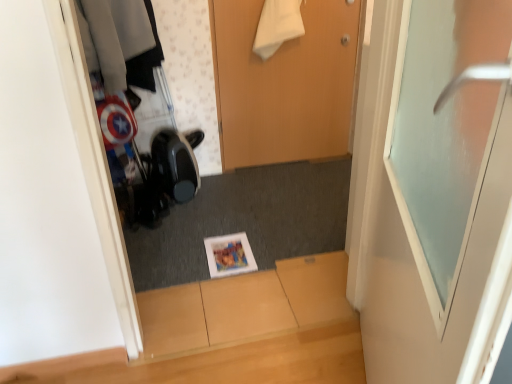
Question: Is frosted glass door at upper right, the first door when ordered from front to back, oriented away from wooden door at center, the second door when ordered from front to back?

Choices:
 (A) yes
 (B) no

Answer: (B)

Question: From the image's perspective, is frosted glass door at upper right, which appears as the 2th door when viewed from the back, below wooden door at center, which is the first door in back-to-front order?

Choices:
 (A) no
 (B) yes

Answer: (B)

Question: Can you confirm if frosted glass door at upper right, the first door when ordered from front to back, is wider than wooden door at center, the second door when ordered from front to back?

Choices:
 (A) yes
 (B) no

Answer: (A)

Question: Is the depth of frosted glass door at upper right, which appears as the 2th door when viewed from the back, less than that of wooden door at center, the second door when ordered from front to back?

Choices:
 (A) yes
 (B) no

Answer: (A)

Question: Considering the relative sizes of frosted glass door at upper right, which appears as the 2th door when viewed from the back, and wooden door at center, the second door when ordered from front to back, in the image provided, is frosted glass door at upper right, which appears as the 2th door when viewed from the back, thinner than wooden door at center, the second door when ordered from front to back,?

Choices:
 (A) yes
 (B) no

Answer: (B)

Question: Is frosted glass door at upper right, the first door when ordered from front to back, further to camera compared to wooden door at center, the second door when ordered from front to back?

Choices:
 (A) yes
 (B) no

Answer: (B)

Question: Is matte paper magazine at center a part of frosted glass door at upper right, the first door when ordered from front to back?

Choices:
 (A) yes
 (B) no

Answer: (B)

Question: Is frosted glass door at upper right, which appears as the 2th door when viewed from the back, not near matte paper magazine at center?

Choices:
 (A) yes
 (B) no

Answer: (A)

Question: Is frosted glass door at upper right, the first door when ordered from front to back, not within matte paper magazine at center?

Choices:
 (A) no
 (B) yes

Answer: (B)

Question: Is frosted glass door at upper right, the first door when ordered from front to back, facing towards matte paper magazine at center?

Choices:
 (A) yes
 (B) no

Answer: (B)

Question: Is the position of frosted glass door at upper right, which appears as the 2th door when viewed from the back, less distant than that of matte paper magazine at center?

Choices:
 (A) yes
 (B) no

Answer: (A)

Question: Is matte paper magazine at center at the back of frosted glass door at upper right, the first door when ordered from front to back?

Choices:
 (A) no
 (B) yes

Answer: (A)

Question: Would you consider wooden door at center, the second door when ordered from front to back, to be distant from frosted glass door at upper right, which appears as the 2th door when viewed from the back?

Choices:
 (A) no
 (B) yes

Answer: (B)